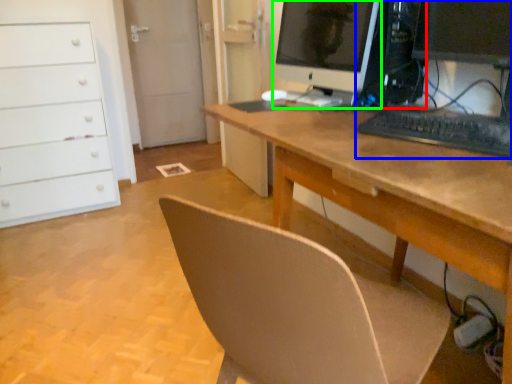
Question: Estimate the real-world distances between objects in this image. Which object is closer to desktop computer (highlighted by a red box), computer (highlighted by a blue box) or computer monitor (highlighted by a green box)?

Choices:
 (A) computer
 (B) computer monitor

Answer: (B)